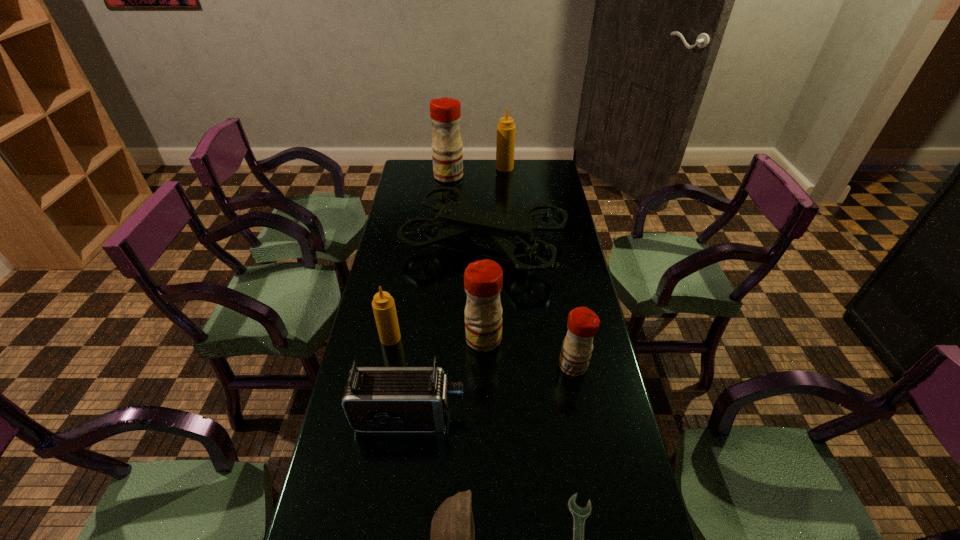
This screenshot has height=540, width=960. I want to click on camcorder that is positioned at the left edge, so click(x=376, y=399).

Locate an element on the screen. The width and height of the screenshot is (960, 540). drone at the right edge is located at coordinates (509, 231).

At what (x,y) coordinates should I click in order to perform the action: click on condiment at the right edge. Please return your answer as a coordinate pair (x, y). Image resolution: width=960 pixels, height=540 pixels. Looking at the image, I should click on point(583,323).

This screenshot has width=960, height=540. Find the location of `object at the far left corner`. object at the far left corner is located at coordinates (445, 113).

Locate an element on the screen. This screenshot has width=960, height=540. vacant region at the left edge of the desktop is located at coordinates (395, 292).

Locate an element on the screen. The image size is (960, 540). free location at the right edge is located at coordinates (541, 194).

Find the location of a particular element. vacant space at the far left corner of the desktop is located at coordinates (412, 160).

Identify the location of vacant region between the right tan condiment and the leftmost red condiment. point(477,172).

Locate an element on the screen. Image resolution: width=960 pixels, height=540 pixels. vacant space that's between the tallest object and the smallest red condiment is located at coordinates (511, 271).

The width and height of the screenshot is (960, 540). Find the location of `unoccupied position between the third nearest object and the seventh nearest object`. unoccupied position between the third nearest object and the seventh nearest object is located at coordinates (446, 330).